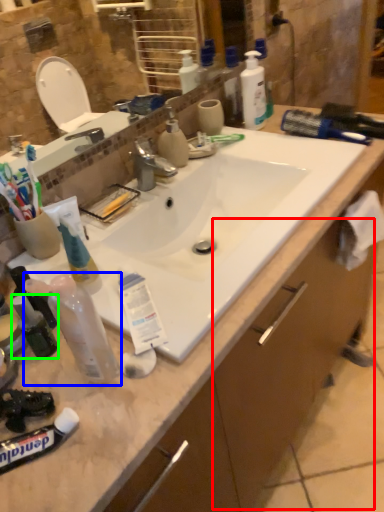
Question: Which object is positioned farthest from drawer (highlighted by a red box)? Select from toiletry (highlighted by a blue box) and mouthwash (highlighted by a green box).

Choices:
 (A) toiletry
 (B) mouthwash

Answer: (B)